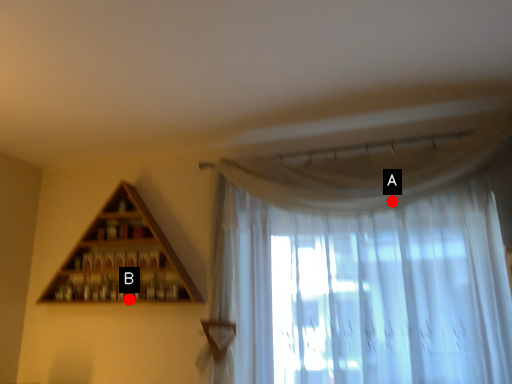
Question: Two points are circled on the image, labeled by A and B beside each circle. Which point is farther from the camera taking this photo?

Choices:
 (A) A is further
 (B) B is further

Answer: (B)